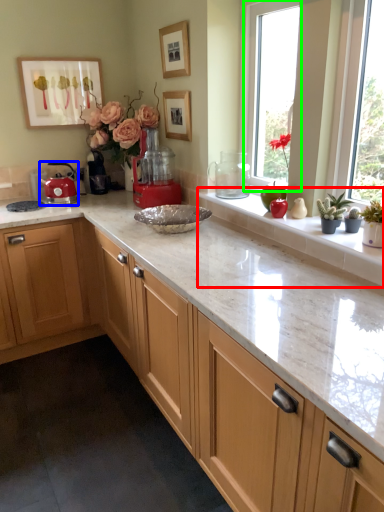
Question: Which object is the closest to the window sill (highlighted by a red box)? Choose among these: kitchen appliance (highlighted by a blue box) or window (highlighted by a green box).

Choices:
 (A) kitchen appliance
 (B) window

Answer: (B)